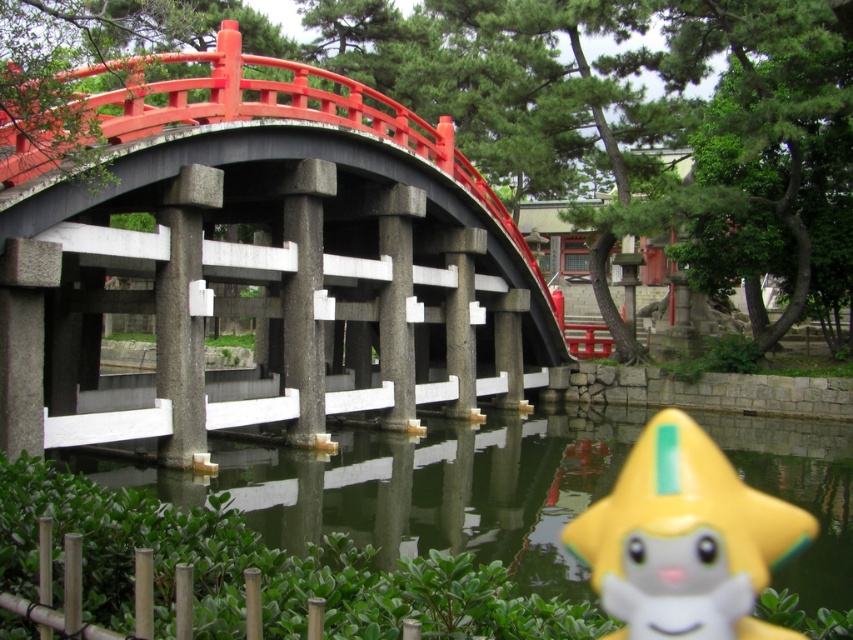
You are a tourist visiting the traditional Japanese garden and want to take a photo of both the smooth stone bridge at center and the yellow matte star at lower right. Since you have a camera with a fixed focal length, you need to know which object is bigger to ensure both fit in the frame. Can you tell me which one is larger?

The smooth stone bridge at center is larger compared to the yellow matte star at lower right, so you should position your camera to focus on the bridge first to ensure both objects fit in the frame.

You are standing at the bottom right corner of the image where the yellow star is located. You want to walk to the green matte water at lower center. Which direction should you move relative to the smooth stone bridge at center?

You should move behind the smooth stone bridge at center to reach the green matte water at lower center since the green matte water at lower center is located behind the smooth stone bridge at center.